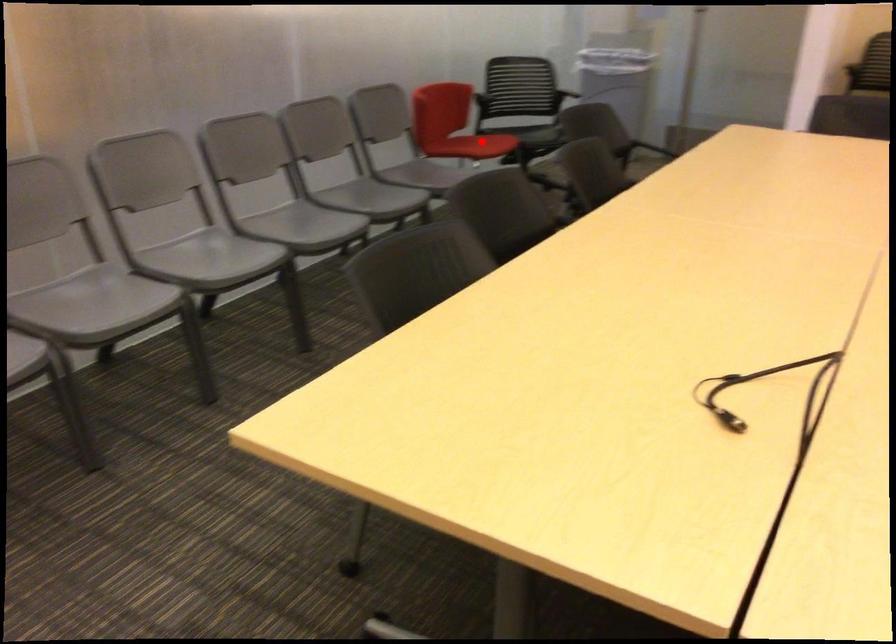
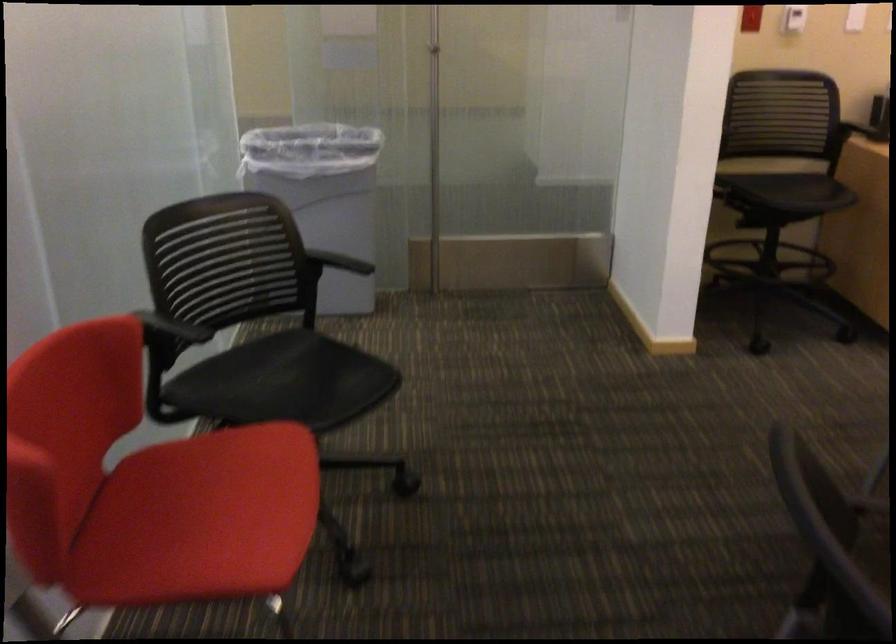
Question: I am providing you with two images of the same scene from different viewpoints. A red point is marked on the first image. At the location where the point appears in image 1, is it still visible in image 2?

Choices:
 (A) Yes
 (B) No

Answer: (A)